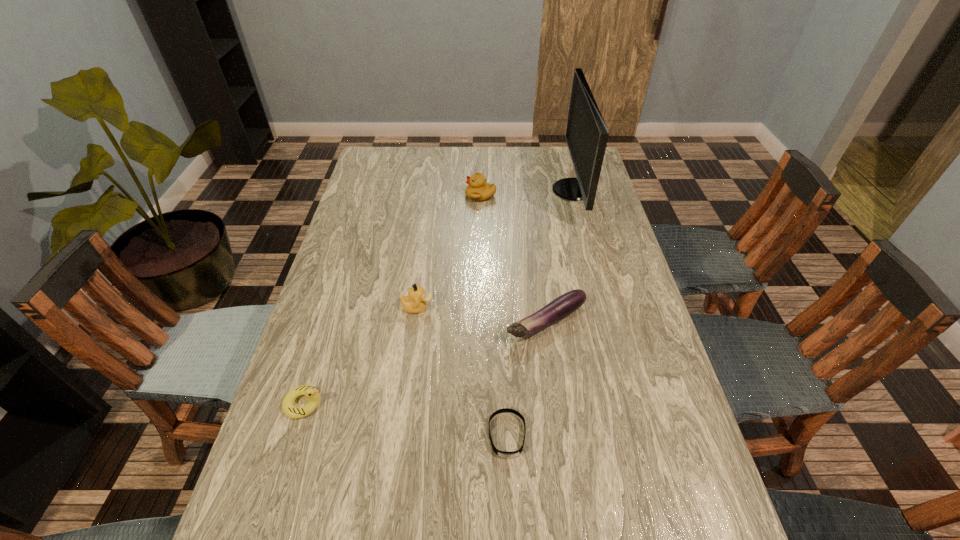
This screenshot has height=540, width=960. In order to click on computer monitor that is positioned at the right edge in this screenshot , I will do `click(586, 135)`.

Find the location of a particular element. The height and width of the screenshot is (540, 960). eggplant that is at the right edge is located at coordinates (564, 305).

Image resolution: width=960 pixels, height=540 pixels. In order to click on object at the far right corner in this screenshot , I will do `click(586, 135)`.

The height and width of the screenshot is (540, 960). What are the coordinates of `vacant position at the far edge of the desktop` in the screenshot? It's located at (530, 158).

You are a GUI agent. You are given a task and a screenshot of the screen. Output one action in this format:
    pyautogui.click(x=<x>, y=<y>)
    Task: Click on the vacant area at the left edge of the desktop
    
    Given the screenshot: What is the action you would take?
    coord(311,485)

At what (x,y) coordinates should I click in order to perform the action: click on vacant space at the right edge of the desktop. Please return your answer as a coordinate pair (x, y). This screenshot has width=960, height=540. Looking at the image, I should click on (622, 263).

You are a GUI agent. You are given a task and a screenshot of the screen. Output one action in this format:
    pyautogui.click(x=<x>, y=<y>)
    Task: Click on the free area in between the tallest object and the leftmost duckling
    This screenshot has height=540, width=960.
    Given the screenshot: What is the action you would take?
    pyautogui.click(x=438, y=297)

Locate an element on the screen. vacant area that lies between the leftmost object and the rightmost duckling is located at coordinates (392, 300).

This screenshot has width=960, height=540. I want to click on vacant area that lies between the farthest duckling and the nearest duckling, so click(x=392, y=300).

Find the location of a particular element. This screenshot has width=960, height=540. free point between the computer monitor and the rightmost duckling is located at coordinates (526, 193).